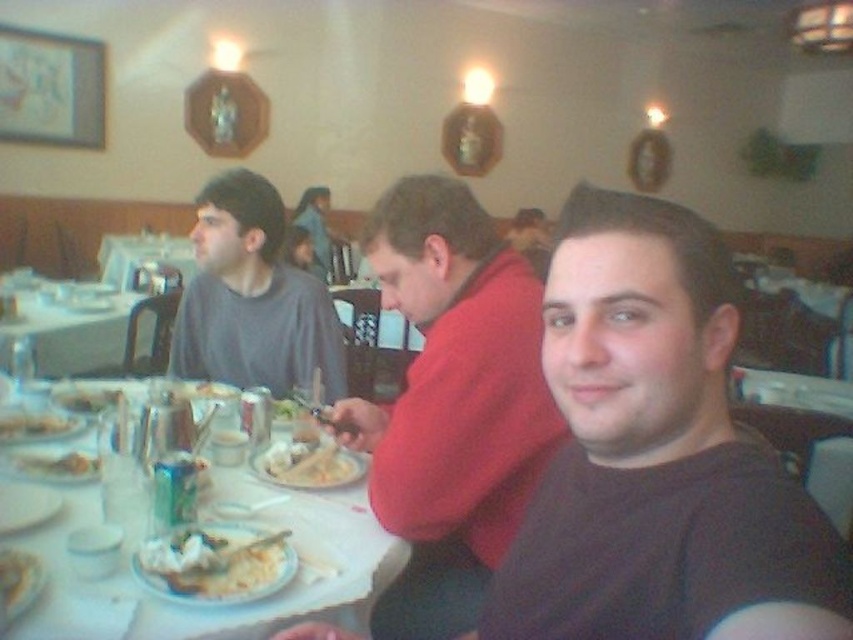
Question: From the image, what is the correct spatial relationship of red matte sweater at center in relation to white creamy pasta at center?

Choices:
 (A) below
 (B) above

Answer: (B)

Question: Observing the image, what is the correct spatial positioning of red matte sweater at center in reference to white glossy table at left?

Choices:
 (A) left
 (B) right

Answer: (B)

Question: Which point is closer to the camera?

Choices:
 (A) dark brown shirt at center
 (B) white creamy rice at lower center
 (C) white paper plate at table left

Answer: (A)

Question: Which object is farther from the camera taking this photo?

Choices:
 (A) white paper plate at center
 (B) dark brown shirt at center
 (C) gray matte shirt at upper left
 (D) white matte plate at center

Answer: (C)

Question: Can you confirm if dark brown shirt at center is bigger than white paper plate at table left?

Choices:
 (A) no
 (B) yes

Answer: (B)

Question: Which object appears farthest from the camera in this image?

Choices:
 (A) white creamy pasta at center
 (B) red matte sweater at center
 (C) dark brown shirt at center

Answer: (A)